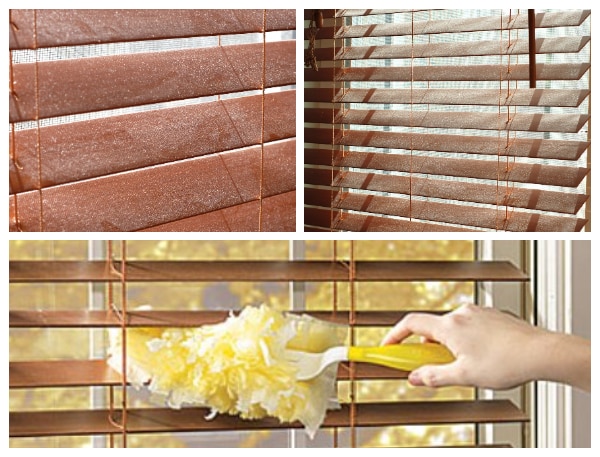
Where is `blinds`? The width and height of the screenshot is (600, 457). blinds is located at coordinates (421, 74).